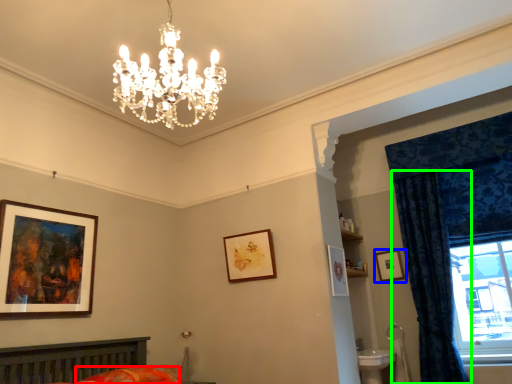
Question: Estimate the real-world distances between objects in this image. Which object is farther from bedding (highlighted by a red box), picture frame (highlighted by a blue box) or curtain (highlighted by a green box)?

Choices:
 (A) picture frame
 (B) curtain

Answer: (B)